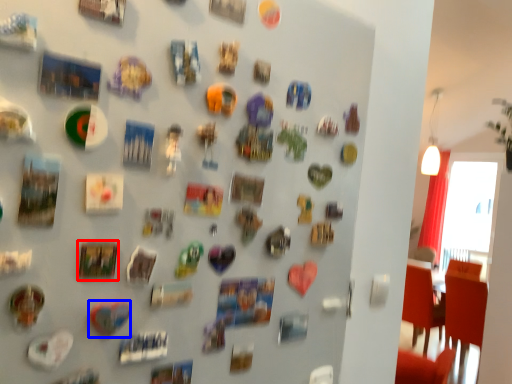
Question: Which of the following is the closest to the observer, art (highlighted by a red box) or art (highlighted by a blue box)?

Choices:
 (A) art
 (B) art

Answer: (A)